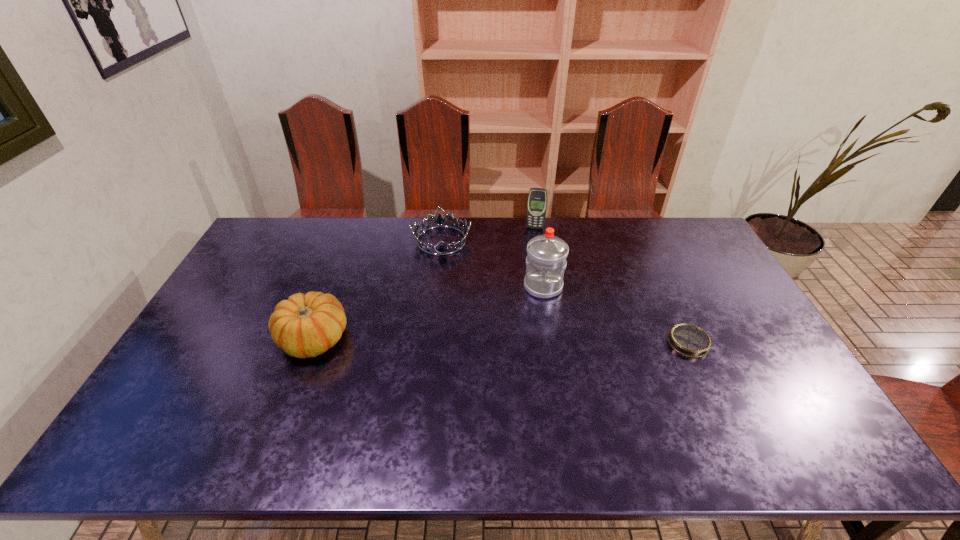
Identify the location of blank area in the image that satisfies the following two spatial constraints: 1. on the front side of the compass; 2. on the left side of the second tallest object. (554, 342).

You are a GUI agent. You are given a task and a screenshot of the screen. Output one action in this format:
    pyautogui.click(x=<x>, y=<y>)
    Task: Click on the free spot that satisfies the following two spatial constraints: 1. on the front side of the compass; 2. on the right side of the cellular telephone
    The width and height of the screenshot is (960, 540).
    Given the screenshot: What is the action you would take?
    pyautogui.click(x=554, y=342)

This screenshot has height=540, width=960. Identify the location of vacant space that satisfies the following two spatial constraints: 1. on the front side of the rightmost object; 2. on the right side of the water bottle. coord(552,342).

The height and width of the screenshot is (540, 960). Find the location of `free space in the image that satisfies the following two spatial constraints: 1. on the front side of the third farthest object; 2. on the right side of the compass`. free space in the image that satisfies the following two spatial constraints: 1. on the front side of the third farthest object; 2. on the right side of the compass is located at coordinates (552, 342).

Locate an element on the screen. This screenshot has height=540, width=960. vacant space that satisfies the following two spatial constraints: 1. on the front side of the shortest object; 2. on the right side of the cellular telephone is located at coordinates (554, 342).

Locate an element on the screen. The image size is (960, 540). free space that satisfies the following two spatial constraints: 1. on the back side of the second tallest object; 2. on the right side of the leftmost object is located at coordinates (355, 228).